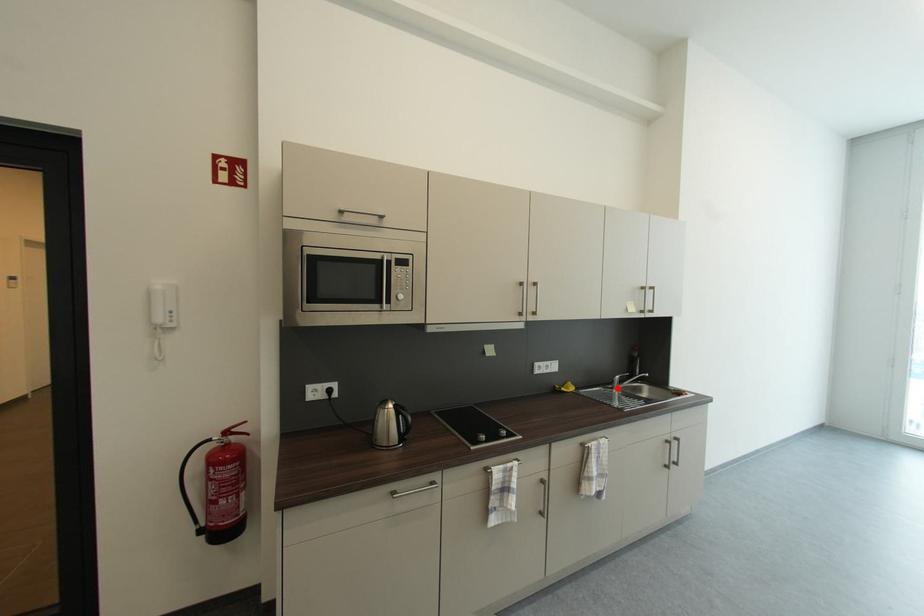
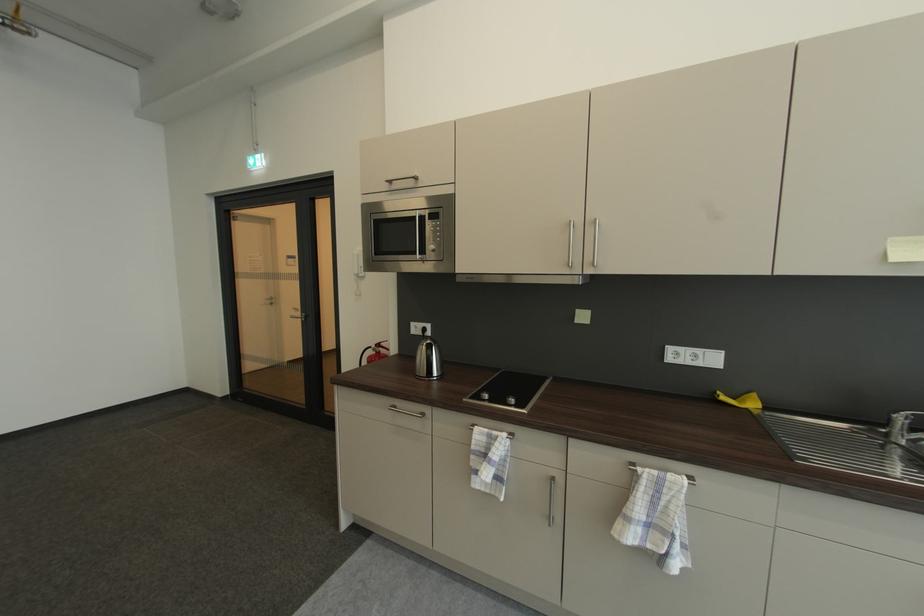
In the second image, find the point that corresponds to the highlighted location in the first image.

(892, 432)